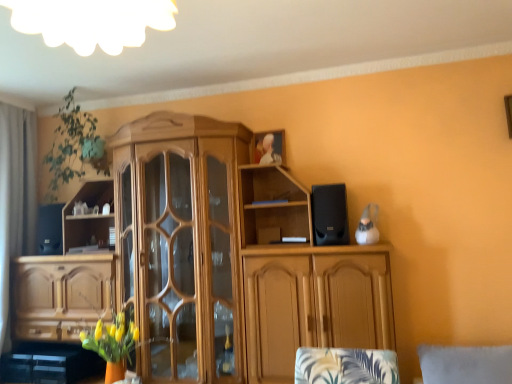
Question: Is black matte speaker at left, marked as the first speaker in a back-to-front arrangement, not inside gray fabric curtain at left?

Choices:
 (A) yes
 (B) no

Answer: (A)

Question: Is black matte speaker at left, marked as the first speaker in a back-to-front arrangement, beside gray fabric curtain at left?

Choices:
 (A) yes
 (B) no

Answer: (B)

Question: Can gray fabric curtain at left be found inside black matte speaker at left, marked as the first speaker in a back-to-front arrangement?

Choices:
 (A) no
 (B) yes

Answer: (A)

Question: From a real-world perspective, is black matte speaker at left, the 2th speaker viewed from the front, positioned under gray fabric curtain at left based on gravity?

Choices:
 (A) no
 (B) yes

Answer: (B)

Question: Is the position of black matte speaker at left, the second speaker viewed from the right, more distant than that of gray fabric curtain at left?

Choices:
 (A) yes
 (B) no

Answer: (A)

Question: From the image's perspective, is black matte speaker at left, marked as the first speaker in a back-to-front arrangement, located above or below wooden cabinet at center?

Choices:
 (A) above
 (B) below

Answer: (A)

Question: From a real-world perspective, is black matte speaker at left, which is counted as the first speaker, starting from the left, physically located above or below wooden cabinet at center?

Choices:
 (A) below
 (B) above

Answer: (B)

Question: Is black matte speaker at left, the 2th speaker viewed from the front, to the left or to the right of wooden cabinet at center in the image?

Choices:
 (A) left
 (B) right

Answer: (A)

Question: Would you say black matte speaker at left, the 2th speaker viewed from the front, is inside or outside wooden cabinet at center?

Choices:
 (A) outside
 (B) inside

Answer: (B)

Question: From a real-world perspective, is wooden cabinet at center positioned above or below gray fabric curtain at left?

Choices:
 (A) above
 (B) below

Answer: (B)

Question: Considering the positions of wooden cabinet at center and gray fabric curtain at left in the image, is wooden cabinet at center wider or thinner than gray fabric curtain at left?

Choices:
 (A) wide
 (B) thin

Answer: (A)

Question: Relative to gray fabric curtain at left, is wooden cabinet at center in front or behind?

Choices:
 (A) front
 (B) behind

Answer: (A)

Question: From their relative heights in the image, would you say wooden cabinet at center is taller or shorter than gray fabric curtain at left?

Choices:
 (A) short
 (B) tall

Answer: (B)

Question: From the image's perspective, is green leafy plant at upper left positioned above or below wooden cabinet at center?

Choices:
 (A) below
 (B) above

Answer: (B)

Question: Looking at the image, does green leafy plant at upper left seem bigger or smaller compared to wooden cabinet at center?

Choices:
 (A) big
 (B) small

Answer: (B)